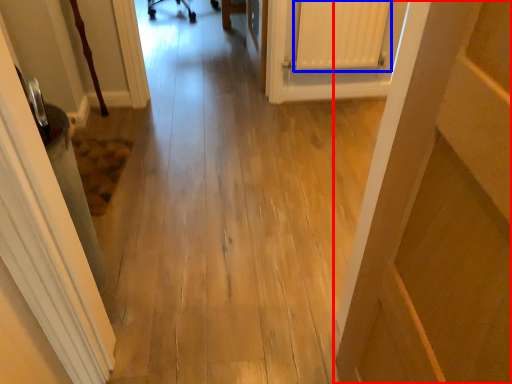
Question: Which object appears closest to the camera in this image, door (highlighted by a red box) or radiator (highlighted by a blue box)?

Choices:
 (A) door
 (B) radiator

Answer: (A)